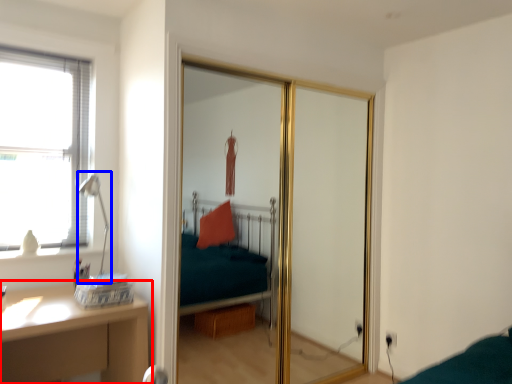
Question: Among these objects, which one is nearest to the camera, table (highlighted by a red box) or table lamp (highlighted by a blue box)?

Choices:
 (A) table
 (B) table lamp

Answer: (A)